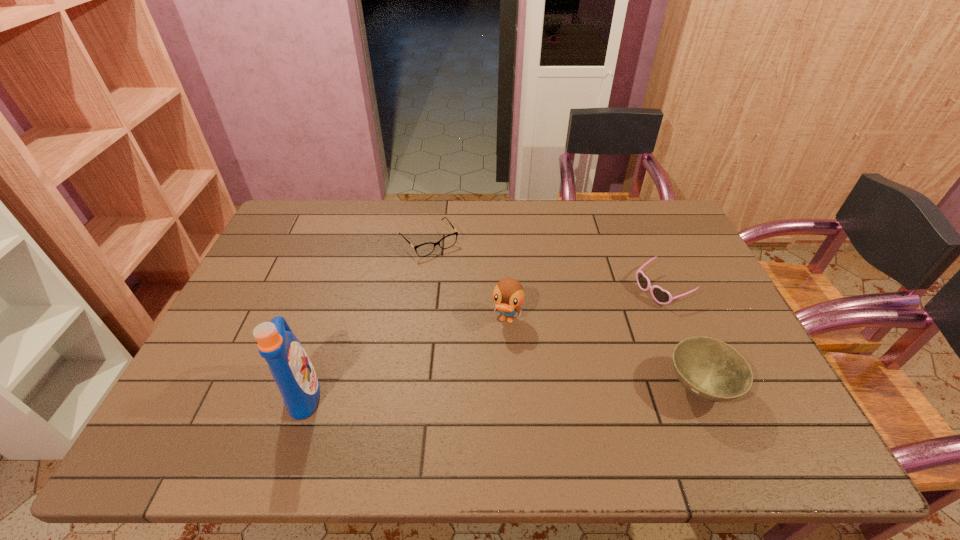
Identify the location of the leftmost object. tap(289, 364).

The height and width of the screenshot is (540, 960). Identify the location of the tallest object. (289, 364).

Locate an element on the screen. The width and height of the screenshot is (960, 540). the third tallest object is located at coordinates (710, 369).

Locate an element on the screen. the third object from right to left is located at coordinates (508, 294).

Identify the location of duck. (508, 294).

I want to click on sunglasses, so click(x=661, y=296).

You are a GUI agent. You are given a task and a screenshot of the screen. Output one action in this format:
    pyautogui.click(x=<x>, y=<y>)
    Task: Click on the shortest object
    
    Given the screenshot: What is the action you would take?
    pyautogui.click(x=448, y=241)

At what (x,y) coordinates should I click in order to perform the action: click on the second object from left to right. Please return your answer as a coordinate pair (x, y). Looking at the image, I should click on (448, 241).

Locate an element on the screen. The image size is (960, 540). vacant region located on the label of the tallest object is located at coordinates (343, 393).

This screenshot has width=960, height=540. In order to click on vacant space located 0.290m on the back of the bowl in this screenshot , I will do `click(654, 280)`.